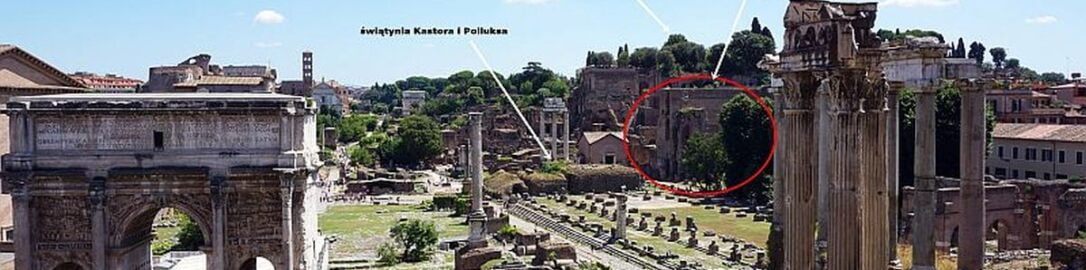
Find the location of a particular element. entry is located at coordinates (178, 253).